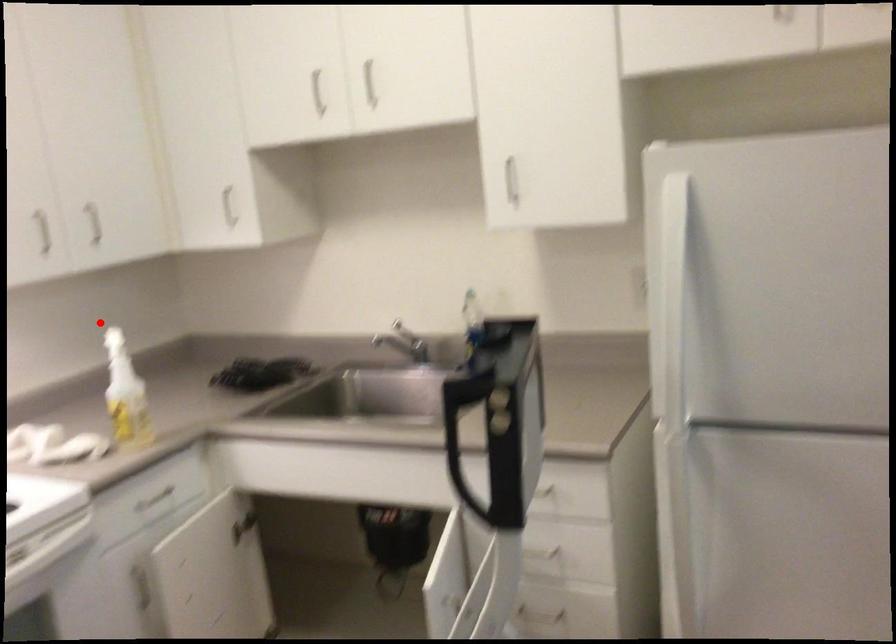
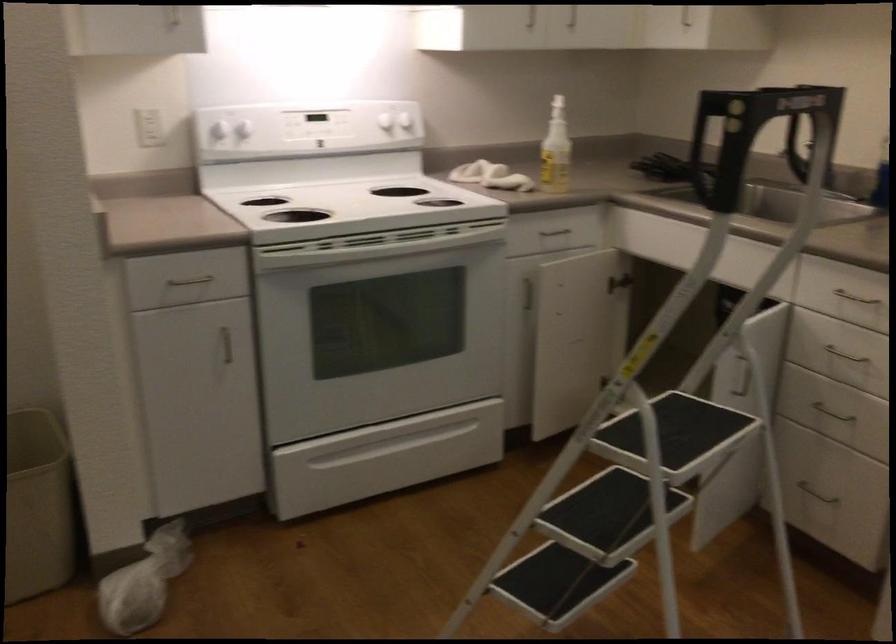
Question: I am providing you with two images of the same scene from different viewpoints. Image1 has a red point marked. In image2, the corresponding 3D location appears at what relative position? Reply with the corresponding letter.

Choices:
 (A) Closer
 (B) Farther

Answer: (B)